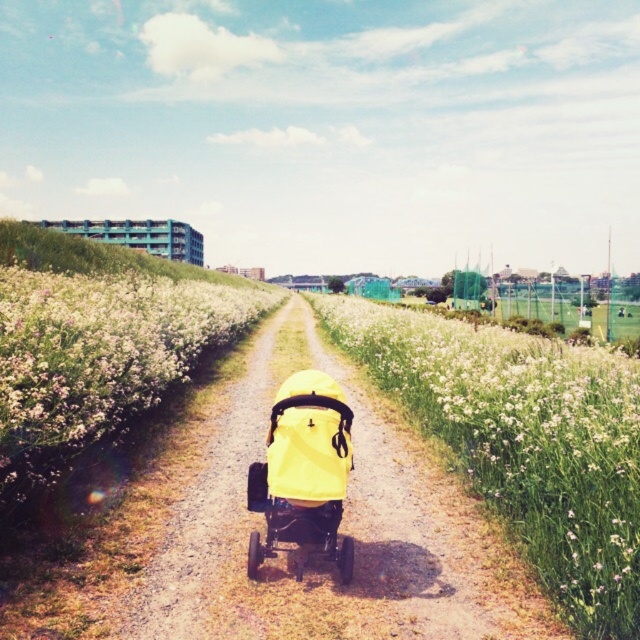
Is yellow fabric stroller at center further to camera compared to yellow matte baby carriage at center?

No, yellow fabric stroller at center is closer to the viewer.

Describe the element at coordinates (522, 438) in the screenshot. I see `yellow fabric stroller at center` at that location.

I want to click on yellow fabric stroller at center, so click(522, 438).

Who is more distant from viewer, (131,273) or (282,531)?

Positioned behind is point (131,273).

Can you confirm if white fluffy flower at left is positioned below yellow matte baby carriage at center?

Incorrect, white fluffy flower at left is not positioned below yellow matte baby carriage at center.

You are a GUI agent. You are given a task and a screenshot of the screen. Output one action in this format:
    pyautogui.click(x=<x>, y=<y>)
    Task: Click on the white fluffy flower at left
    
    Given the screenshot: What is the action you would take?
    pyautogui.click(x=99, y=356)

This screenshot has width=640, height=640. Identify the location of white fluffy flower at left. (99, 356).

Does yellow fabric stroller at center appear under white fluffy flower at left?

Correct, yellow fabric stroller at center is located below white fluffy flower at left.

The width and height of the screenshot is (640, 640). What do you see at coordinates (522, 438) in the screenshot?
I see `yellow fabric stroller at center` at bounding box center [522, 438].

Is point (608, 465) farther from camera compared to point (220, 316)?

That is False.

Find the location of a particular element. yellow fabric stroller at center is located at coordinates (522, 438).